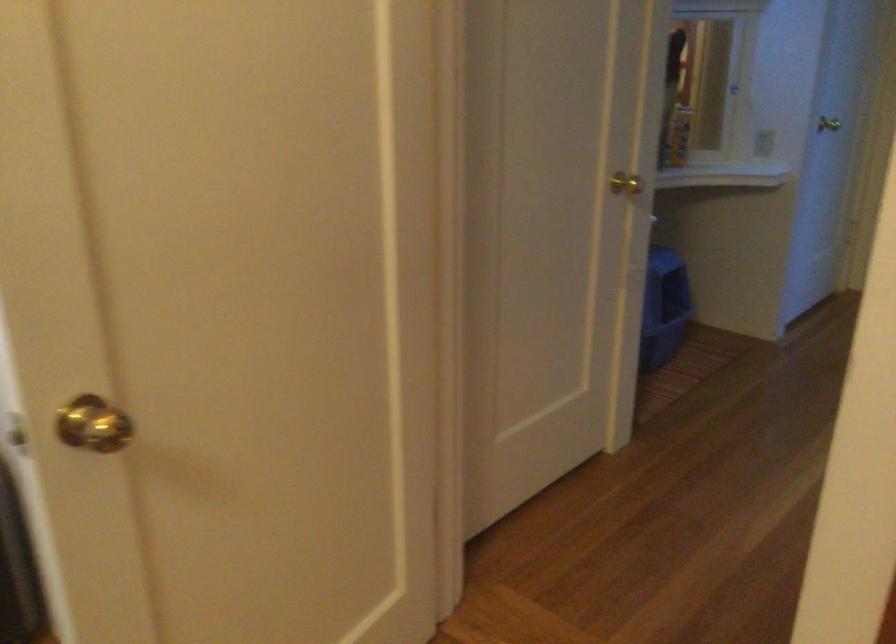
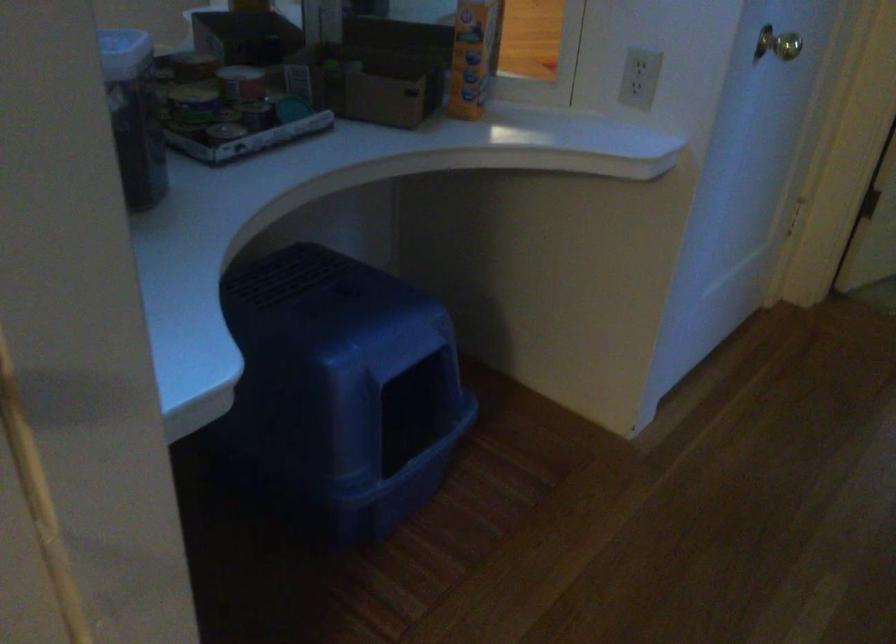
In the second image, find the point that corresponds to the point at 678,131 in the first image.

(472, 57)